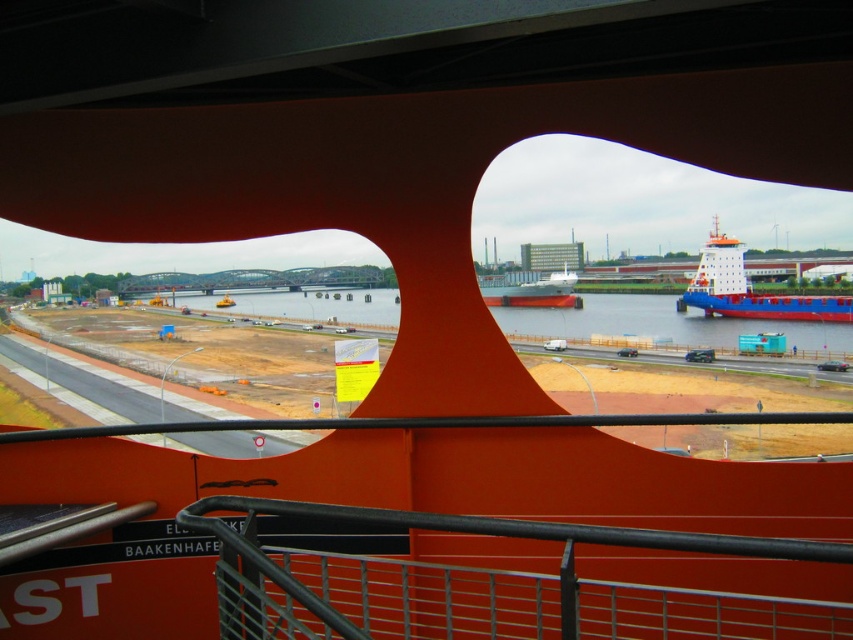
Does blue water at center have a smaller size compared to white matte cargo ship at center?

No.

Is the position of blue water at center less distant than that of white matte cargo ship at center?

No, it is behind white matte cargo ship at center.

Measure the distance between blue water at center and camera.

44.80 meters

Find the location of `blue water at center`. blue water at center is located at coordinates (663, 324).

Who is more forward, (253, 568) or (689, 326)?

Point (253, 568) is more forward.

Can you confirm if metallic gray rail at center is positioned above blue water at center?

No.

Who is more forward, (361, 632) or (614, 308)?

Point (361, 632)

Locate an element on the screen. metallic gray rail at center is located at coordinates (486, 584).

In the scene shown: Which is above, blue matte container ship at right or white matte cargo ship at center?

white matte cargo ship at center

Does point (720, 301) come farther from viewer compared to point (566, 296)?

No, (720, 301) is in front of (566, 296).

Describe the element at coordinates (750, 289) in the screenshot. I see `blue matte container ship at right` at that location.

Where is `blue matte container ship at right`? The width and height of the screenshot is (853, 640). blue matte container ship at right is located at coordinates (750, 289).